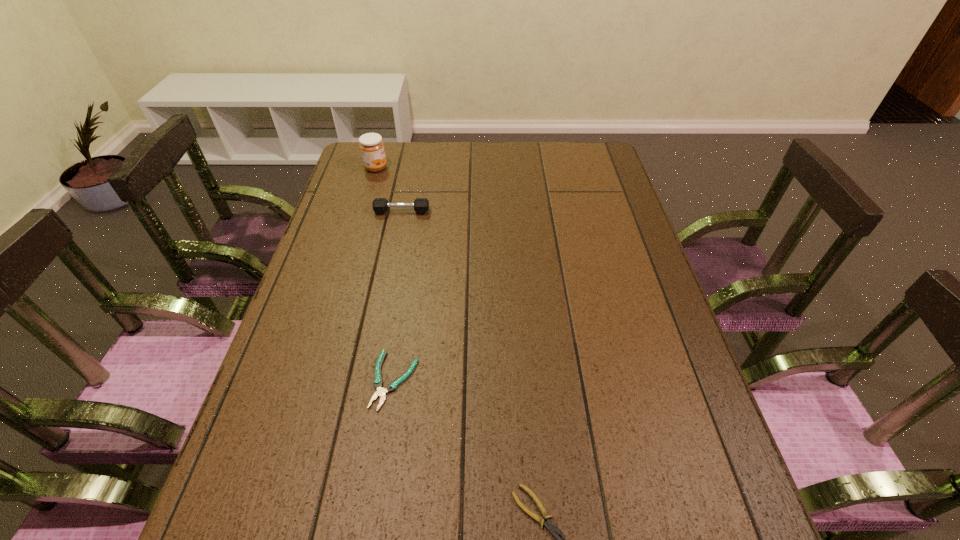
The height and width of the screenshot is (540, 960). Find the location of `unoccupied area between the farthest object and the farther pliers`. unoccupied area between the farthest object and the farther pliers is located at coordinates (385, 274).

The height and width of the screenshot is (540, 960). Identify the location of vacant space that's between the jam and the dumbbell. (389, 190).

Find the location of `vacant space in between the second tallest object and the left pliers`. vacant space in between the second tallest object and the left pliers is located at coordinates (398, 296).

The image size is (960, 540). I want to click on vacant area that lies between the second nearest object and the farthest object, so click(x=385, y=274).

Identify the location of empty space between the dumbbell and the jam. (389, 190).

Identify the location of free space between the tallest object and the third shortest object. (389, 190).

Find the location of a particular element. free space between the third nearest object and the third farthest object is located at coordinates (398, 296).

This screenshot has width=960, height=540. I want to click on object identified as the second closest to the jam, so click(381, 392).

Locate an element on the screen. This screenshot has width=960, height=540. object that stands as the second closest to the nearest object is located at coordinates (380, 205).

Image resolution: width=960 pixels, height=540 pixels. Identify the location of free space that satisfies the following two spatial constraints: 1. on the front label of the farthest object; 2. on the right side of the second nearest object. (312, 380).